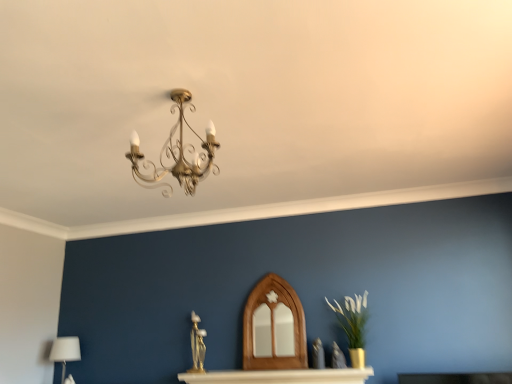
Question: Can white fabric lampshade at lower left be found inside green matte vase at right?

Choices:
 (A) no
 (B) yes

Answer: (A)

Question: Can you confirm if green matte vase at right is taller than white fabric lampshade at lower left?

Choices:
 (A) yes
 (B) no

Answer: (A)

Question: Can you confirm if green matte vase at right is positioned to the left of white fabric lampshade at lower left?

Choices:
 (A) yes
 (B) no

Answer: (B)

Question: From the image's perspective, is green matte vase at right on white fabric lampshade at lower left?

Choices:
 (A) yes
 (B) no

Answer: (A)

Question: Is green matte vase at right bigger than white fabric lampshade at lower left?

Choices:
 (A) yes
 (B) no

Answer: (A)

Question: Is green matte vase at right inside or outside of white fabric lampshade at lower left?

Choices:
 (A) inside
 (B) outside

Answer: (B)

Question: From a real-world perspective, is green matte vase at right positioned above or below white fabric lampshade at lower left?

Choices:
 (A) above
 (B) below

Answer: (A)

Question: From the image's perspective, is green matte vase at right above or below white fabric lampshade at lower left?

Choices:
 (A) below
 (B) above

Answer: (B)

Question: In the image, is green matte vase at right positioned in front of or behind white fabric lampshade at lower left?

Choices:
 (A) behind
 (B) front

Answer: (B)

Question: Considering the positions of point (60, 382) and point (211, 168), is point (60, 382) closer or farther from the camera than point (211, 168)?

Choices:
 (A) closer
 (B) farther

Answer: (B)

Question: In terms of height, does white fabric lampshade at lower left look taller or shorter compared to gold metallic chandelier at upper center?

Choices:
 (A) tall
 (B) short

Answer: (B)

Question: From a real-world perspective, is white fabric lampshade at lower left positioned above or below gold metallic chandelier at upper center?

Choices:
 (A) above
 (B) below

Answer: (B)

Question: From the image's perspective, is white fabric lampshade at lower left located above or below gold metallic chandelier at upper center?

Choices:
 (A) above
 (B) below

Answer: (B)

Question: Visually, is white glossy table at center positioned to the left or to the right of gold metallic chandelier at upper center?

Choices:
 (A) right
 (B) left

Answer: (A)

Question: Considering the positions of white glossy table at center and gold metallic chandelier at upper center in the image, is white glossy table at center wider or thinner than gold metallic chandelier at upper center?

Choices:
 (A) thin
 (B) wide

Answer: (A)